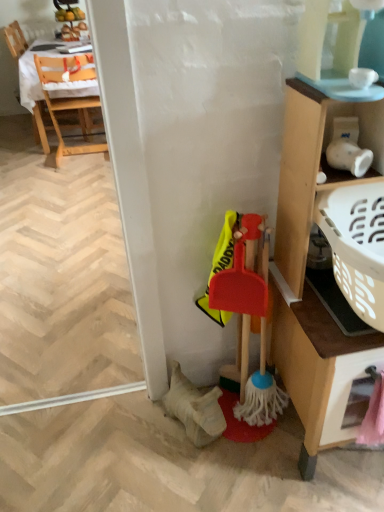
Question: Does wooden chair at upper left, acting as the 1th chair starting from the left, have a larger size compared to rubberized plastic broom at lower right?

Choices:
 (A) yes
 (B) no

Answer: (A)

Question: Considering the relative sizes of wooden chair at upper left, acting as the 1th chair starting from the left, and rubberized plastic broom at lower right in the image provided, is wooden chair at upper left, acting as the 1th chair starting from the left, taller than rubberized plastic broom at lower right?

Choices:
 (A) yes
 (B) no

Answer: (A)

Question: Does wooden chair at upper left, acting as the 1th chair starting from the left, appear on the left side of rubberized plastic broom at lower right?

Choices:
 (A) yes
 (B) no

Answer: (A)

Question: Is wooden chair at upper left, acting as the 1th chair starting from the left, not close to rubberized plastic broom at lower right?

Choices:
 (A) yes
 (B) no

Answer: (A)

Question: Is wooden chair at upper left, acting as the 1th chair starting from the left, smaller than rubberized plastic broom at lower right?

Choices:
 (A) yes
 (B) no

Answer: (B)

Question: From the image's perspective, relative to wooden cabinet at right, is rubberized plastic broom at lower right above or below?

Choices:
 (A) above
 (B) below

Answer: (B)

Question: From their relative heights in the image, would you say rubberized plastic broom at lower right is taller or shorter than wooden cabinet at right?

Choices:
 (A) short
 (B) tall

Answer: (A)

Question: Would you say rubberized plastic broom at lower right is inside or outside wooden cabinet at right?

Choices:
 (A) inside
 (B) outside

Answer: (B)

Question: Is rubberized plastic broom at lower right bigger or smaller than wooden cabinet at right?

Choices:
 (A) big
 (B) small

Answer: (B)

Question: Is pink plastic drawer at lower right to the left or to the right of transparent plastic screen door at lower right in the image?

Choices:
 (A) left
 (B) right

Answer: (B)

Question: Looking at the image, does pink plastic drawer at lower right seem bigger or smaller compared to transparent plastic screen door at lower right?

Choices:
 (A) big
 (B) small

Answer: (B)

Question: Considering the positions of point (339, 380) and point (129, 375), is point (339, 380) closer or farther from the camera than point (129, 375)?

Choices:
 (A) closer
 (B) farther

Answer: (A)

Question: From the image's perspective, relative to transparent plastic screen door at lower right, is pink plastic drawer at lower right above or below?

Choices:
 (A) below
 (B) above

Answer: (A)

Question: Considering their positions, is wooden cabinet at right located in front of or behind rubberized plastic broom at lower right?

Choices:
 (A) front
 (B) behind

Answer: (A)

Question: Is wooden cabinet at right taller or shorter than rubberized plastic broom at lower right?

Choices:
 (A) short
 (B) tall

Answer: (B)